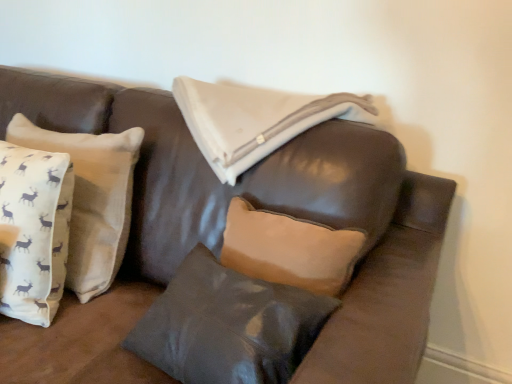
How much space does matte gray pillow at center, arranged as the second pillow when viewed from the left, occupy horizontally?

The width of matte gray pillow at center, arranged as the second pillow when viewed from the left, is 7.22 inches.

What do you see at coordinates (228, 325) in the screenshot? I see `matte gray pillow at center, acting as the 1th pillow starting from the right` at bounding box center [228, 325].

Locate an element on the screen. The height and width of the screenshot is (384, 512). matte gray pillow at center, acting as the 1th pillow starting from the right is located at coordinates (228, 325).

How much space does white cotton cushion at left, which ranks as the 2th pillow in right-to-left order, occupy horizontally?

It is 6.68 inches.

What do you see at coordinates (91, 198) in the screenshot? I see `white cotton cushion at left, which ranks as the 2th pillow in right-to-left order` at bounding box center [91, 198].

Find the location of a particular element. white cotton cushion at left, the first pillow from the left is located at coordinates (91, 198).

Where is `matte gray pillow at center, arranged as the second pillow when viewed from the left`? The width and height of the screenshot is (512, 384). matte gray pillow at center, arranged as the second pillow when viewed from the left is located at coordinates pyautogui.click(x=228, y=325).

Is white cotton cushion at left, the first pillow from the left, to the right of matte gray pillow at center, acting as the 1th pillow starting from the right, from the viewer's perspective?

Incorrect, white cotton cushion at left, the first pillow from the left, is not on the right side of matte gray pillow at center, acting as the 1th pillow starting from the right.

In the scene shown: Does white cotton cushion at left, which ranks as the 2th pillow in right-to-left order, come behind matte gray pillow at center, acting as the 1th pillow starting from the right?

Yes, white cotton cushion at left, which ranks as the 2th pillow in right-to-left order, is behind matte gray pillow at center, acting as the 1th pillow starting from the right.

Does point (7, 130) come in front of point (226, 286)?

No, (7, 130) is behind (226, 286).

From the image's perspective, is white cotton cushion at left, which ranks as the 2th pillow in right-to-left order, beneath matte gray pillow at center, acting as the 1th pillow starting from the right?

No, from the image's perspective, white cotton cushion at left, which ranks as the 2th pillow in right-to-left order, is not beneath matte gray pillow at center, acting as the 1th pillow starting from the right.

From a real-world perspective, is white cotton cushion at left, which ranks as the 2th pillow in right-to-left order, on top of matte gray pillow at center, acting as the 1th pillow starting from the right?

Correct, in the physical world, white cotton cushion at left, which ranks as the 2th pillow in right-to-left order, is higher than matte gray pillow at center, acting as the 1th pillow starting from the right.

In terms of width, does white cotton cushion at left, the first pillow from the left, look wider or thinner when compared to matte gray pillow at center, acting as the 1th pillow starting from the right?

Considering their sizes, white cotton cushion at left, the first pillow from the left, looks slimmer than matte gray pillow at center, acting as the 1th pillow starting from the right.

Can you confirm if white cotton cushion at left, which ranks as the 2th pillow in right-to-left order, is taller than matte gray pillow at center, acting as the 1th pillow starting from the right?

Indeed, white cotton cushion at left, which ranks as the 2th pillow in right-to-left order, has a greater height compared to matte gray pillow at center, acting as the 1th pillow starting from the right.

Which of these two, white cotton cushion at left, the first pillow from the left, or matte gray pillow at center, acting as the 1th pillow starting from the right, is bigger?

white cotton cushion at left, the first pillow from the left, is bigger.

Is matte gray pillow at center, acting as the 1th pillow starting from the right, completely or partially inside white cotton cushion at left, the first pillow from the left?

No.

Is the surface of white cotton cushion at left, the first pillow from the left, in direct contact with matte gray pillow at center, acting as the 1th pillow starting from the right?

white cotton cushion at left, the first pillow from the left, is not next to matte gray pillow at center, acting as the 1th pillow starting from the right, and they're not touching.

Is white cotton cushion at left, the first pillow from the left, oriented towards matte gray pillow at center, arranged as the second pillow when viewed from the left?

Answer: No, white cotton cushion at left, the first pillow from the left, does not turn towards matte gray pillow at center, arranged as the second pillow when viewed from the left.

What's the angular difference between white cotton cushion at left, which ranks as the 2th pillow in right-to-left order, and matte gray pillow at center, arranged as the second pillow when viewed from the left,'s facing directions?

The facing directions of white cotton cushion at left, which ranks as the 2th pillow in right-to-left order, and matte gray pillow at center, arranged as the second pillow when viewed from the left, are 10.6 degrees apart.

This screenshot has width=512, height=384. I want to click on pillow located in front of the white cotton cushion at left, the first pillow from the left, so click(228, 325).

Which is more to the right, matte gray pillow at center, acting as the 1th pillow starting from the right, or white cotton cushion at left, the first pillow from the left?

Positioned to the right is matte gray pillow at center, acting as the 1th pillow starting from the right.

Relative to white cotton cushion at left, the first pillow from the left, is matte gray pillow at center, arranged as the second pillow when viewed from the left, in front or behind?

matte gray pillow at center, arranged as the second pillow when viewed from the left, is positioned closer to the viewer than white cotton cushion at left, the first pillow from the left.

In the scene shown: Which is further, (178, 308) or (16, 131)?

The point (16, 131) is more distant.

From the image's perspective, between matte gray pillow at center, arranged as the second pillow when viewed from the left, and white cotton cushion at left, the first pillow from the left, who is located below?

matte gray pillow at center, arranged as the second pillow when viewed from the left, from the image's perspective.

From a real-world perspective, is matte gray pillow at center, arranged as the second pillow when viewed from the left, physically located above or below white cotton cushion at left, the first pillow from the left?

matte gray pillow at center, arranged as the second pillow when viewed from the left, is below white cotton cushion at left, the first pillow from the left.

Is matte gray pillow at center, acting as the 1th pillow starting from the right, wider than white cotton cushion at left, the first pillow from the left?

Yes, matte gray pillow at center, acting as the 1th pillow starting from the right, is wider than white cotton cushion at left, the first pillow from the left.

Looking at this image, is matte gray pillow at center, acting as the 1th pillow starting from the right, taller than white cotton cushion at left, the first pillow from the left?

No, matte gray pillow at center, acting as the 1th pillow starting from the right, is not taller than white cotton cushion at left, the first pillow from the left.

Based on their sizes in the image, would you say matte gray pillow at center, arranged as the second pillow when viewed from the left, is bigger or smaller than white cotton cushion at left, which ranks as the 2th pillow in right-to-left order?

Considering their sizes, matte gray pillow at center, arranged as the second pillow when viewed from the left, takes up less space than white cotton cushion at left, which ranks as the 2th pillow in right-to-left order.

Is matte gray pillow at center, arranged as the second pillow when viewed from the left, outside of white cotton cushion at left, which ranks as the 2th pillow in right-to-left order?

Indeed, matte gray pillow at center, arranged as the second pillow when viewed from the left, is completely outside white cotton cushion at left, which ranks as the 2th pillow in right-to-left order.

Is matte gray pillow at center, arranged as the second pillow when viewed from the left, in contact with white cotton cushion at left, the first pillow from the left?

No, matte gray pillow at center, arranged as the second pillow when viewed from the left, is not touching white cotton cushion at left, the first pillow from the left.

Is white cotton cushion at left, the first pillow from the left, at the back of matte gray pillow at center, acting as the 1th pillow starting from the right?

No, white cotton cushion at left, the first pillow from the left, is not at the back of matte gray pillow at center, acting as the 1th pillow starting from the right.

What's the angular difference between matte gray pillow at center, arranged as the second pillow when viewed from the left, and white cotton cushion at left, which ranks as the 2th pillow in right-to-left order,'s facing directions?

The angular difference between matte gray pillow at center, arranged as the second pillow when viewed from the left, and white cotton cushion at left, which ranks as the 2th pillow in right-to-left order, is 10.6 degrees.

Could you measure the distance between matte gray pillow at center, acting as the 1th pillow starting from the right, and white cotton cushion at left, the first pillow from the left?

matte gray pillow at center, acting as the 1th pillow starting from the right, is 15.56 inches from white cotton cushion at left, the first pillow from the left.

The height and width of the screenshot is (384, 512). In order to click on pillow that appears behind the matte gray pillow at center, acting as the 1th pillow starting from the right in this screenshot , I will do `click(91, 198)`.

At what (x,y) coordinates should I click in order to perform the action: click on pillow above the matte gray pillow at center, acting as the 1th pillow starting from the right (from a real-world perspective). Please return your answer as a coordinate pair (x, y). This screenshot has height=384, width=512. Looking at the image, I should click on (91, 198).

The width and height of the screenshot is (512, 384). In order to click on pillow on the right of white cotton cushion at left, the first pillow from the left in this screenshot , I will do `click(228, 325)`.